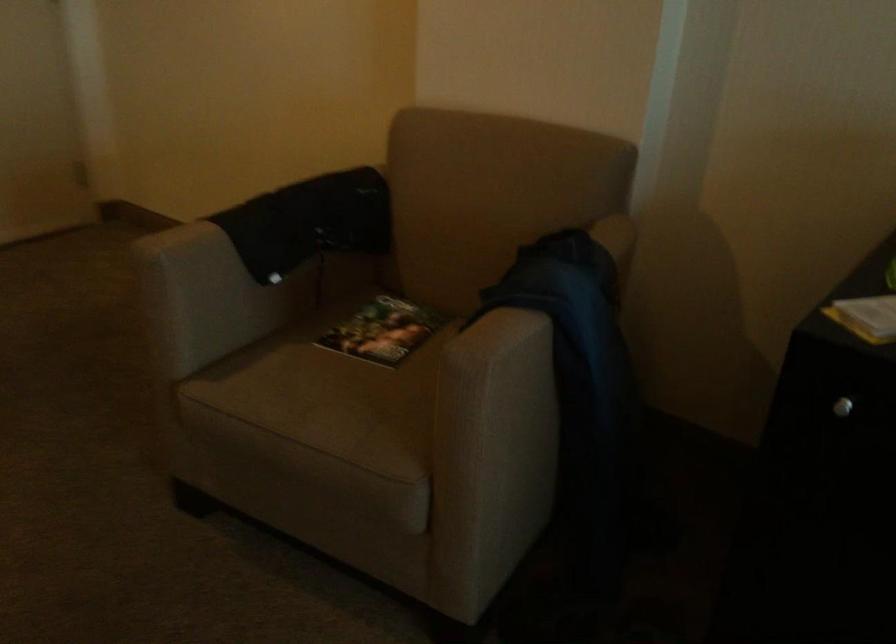
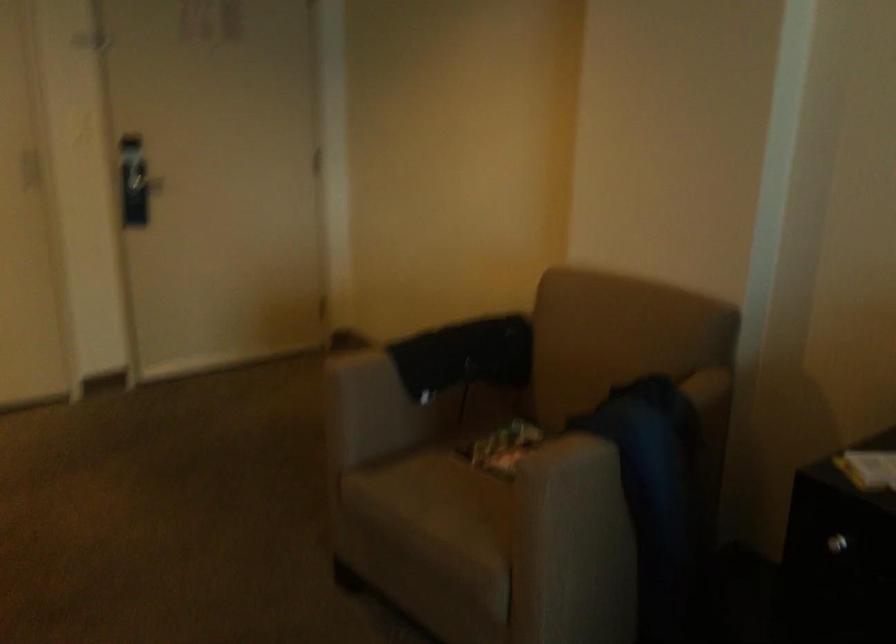
Question: Based on the continuous images, in which direction is the camera rotating? Reply with the corresponding letter.

Choices:
 (A) Left
 (B) Right
 (C) Up
 (D) Down

Answer: (A)